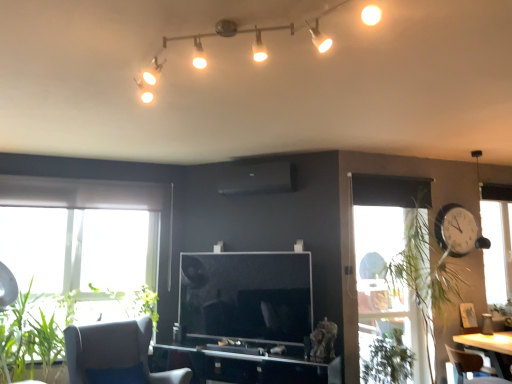
You are a GUI agent. You are given a task and a screenshot of the screen. Output one action in this format:
    pyautogui.click(x=<x>, y=<y>)
    Task: Click on the free space above matte white track lights at upper center (from a real-world perspective)
    
    Given the screenshot: What is the action you would take?
    pyautogui.click(x=223, y=29)